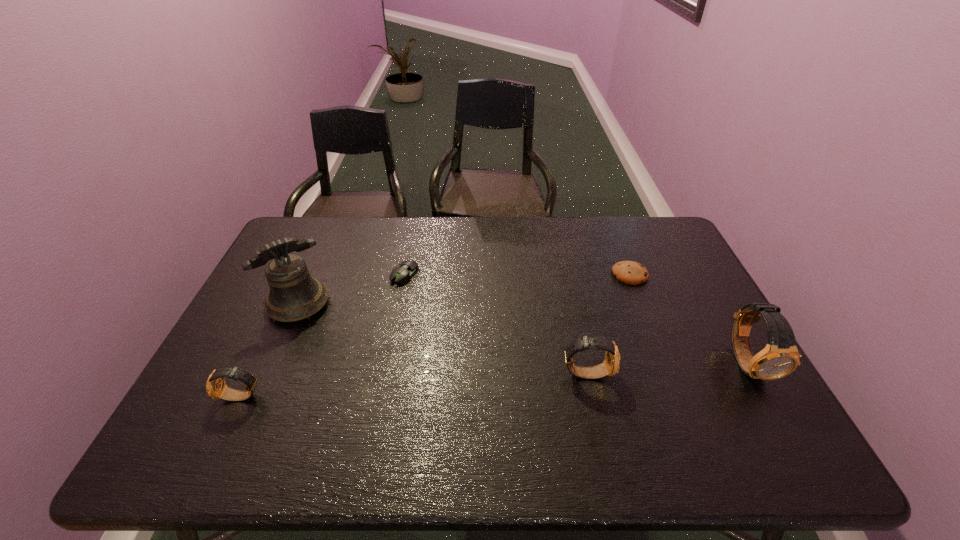
Find the location of a particular element. The image size is (960, 540). free region located 0.250m on the back of the bell is located at coordinates (328, 237).

Identify the location of free spot located on the front of the fourth object from right to left. (391, 349).

The image size is (960, 540). Identify the location of vacant space located 0.050m on the right of the fifth object from left to right. (663, 274).

The width and height of the screenshot is (960, 540). What are the coordinates of `watch at the left edge` in the screenshot? It's located at (216, 387).

Locate an element on the screen. The width and height of the screenshot is (960, 540). bell at the left edge is located at coordinates coord(294,295).

This screenshot has height=540, width=960. Identify the location of watch present at the right edge. (780, 357).

The image size is (960, 540). In order to click on cookie positioned at the right edge in this screenshot , I will do `click(629, 272)`.

Where is `object positioned at the near left corner`? The width and height of the screenshot is (960, 540). object positioned at the near left corner is located at coordinates (216, 387).

Image resolution: width=960 pixels, height=540 pixels. I want to click on object that is at the near right corner, so click(780, 357).

This screenshot has height=540, width=960. I want to click on free point at the far edge, so click(427, 223).